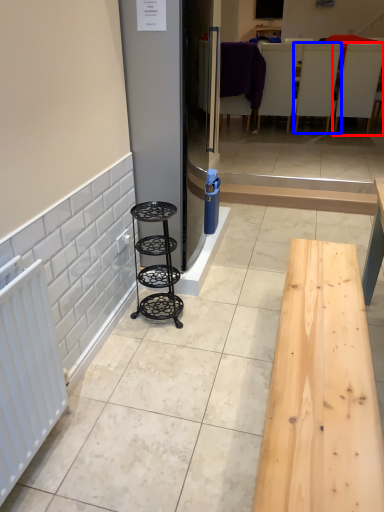
Question: Among these objects, which one is farthest to the camera, furniture (highlighted by a red box) or furniture (highlighted by a blue box)?

Choices:
 (A) furniture
 (B) furniture

Answer: (B)